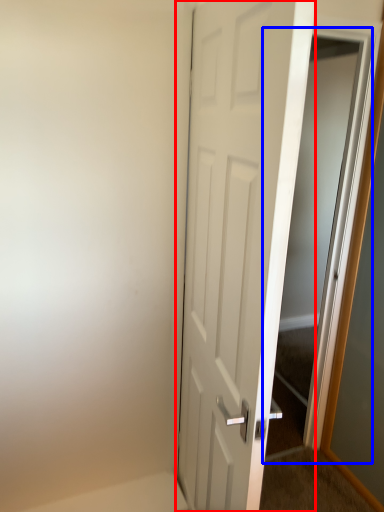
Question: Among these objects, which one is nearest to the camera, door (highlighted by a red box) or elevator (highlighted by a blue box)?

Choices:
 (A) door
 (B) elevator

Answer: (A)